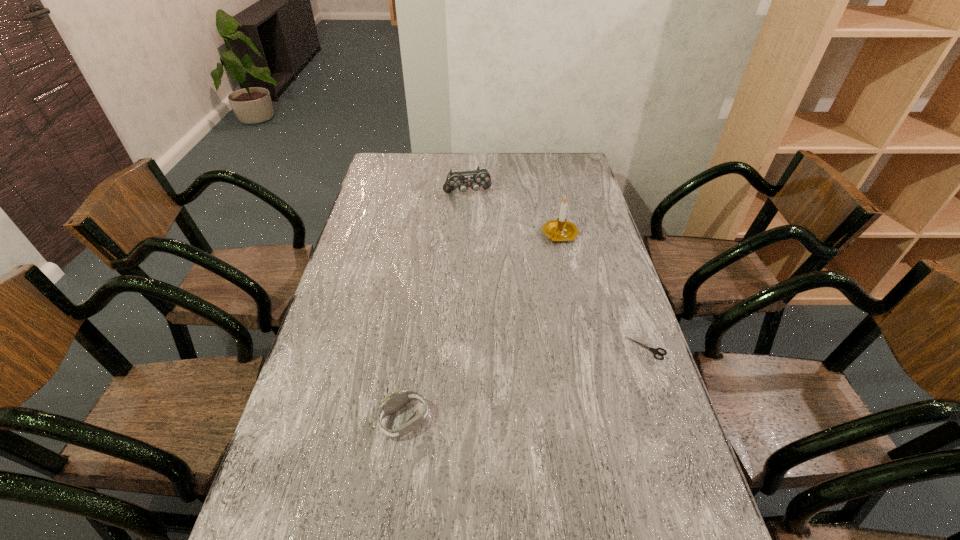
The width and height of the screenshot is (960, 540). Identify the location of free space at the near edge of the desktop. point(578,502).

Locate an element on the screen. vacant space at the left edge is located at coordinates tap(294, 435).

Locate an element on the screen. free spot at the right edge of the desktop is located at coordinates (581, 186).

Identify the location of vacant area that lies between the third shortest object and the shears. (557, 271).

Identify the location of vacant area between the second tallest object and the second nearest object. point(557,271).

Identify the location of empty space between the third shortest object and the candle holder. The image size is (960, 540). (514, 214).

The height and width of the screenshot is (540, 960). I want to click on free space between the candle holder and the shortest object, so click(603, 292).

This screenshot has height=540, width=960. I want to click on free space between the nearest object and the control, so click(x=436, y=307).

At what (x,y) coordinates should I click in order to perform the action: click on unoccupied position between the control and the third object from left to right. Please return your answer as a coordinate pair (x, y). The width and height of the screenshot is (960, 540). Looking at the image, I should click on (514, 214).

Image resolution: width=960 pixels, height=540 pixels. Find the location of `vacant area that lies between the shears and the third shortest object`. vacant area that lies between the shears and the third shortest object is located at coordinates (557, 271).